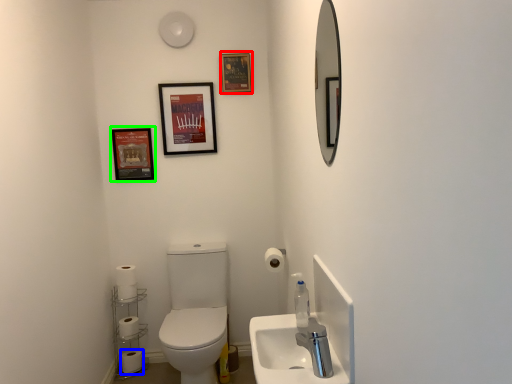
Question: Considering the real-world distances, which object is closest to decorative picture (highlighted by a red box)? toilet paper (highlighted by a blue box) or decorative picture (highlighted by a green box).

Choices:
 (A) toilet paper
 (B) decorative picture

Answer: (B)